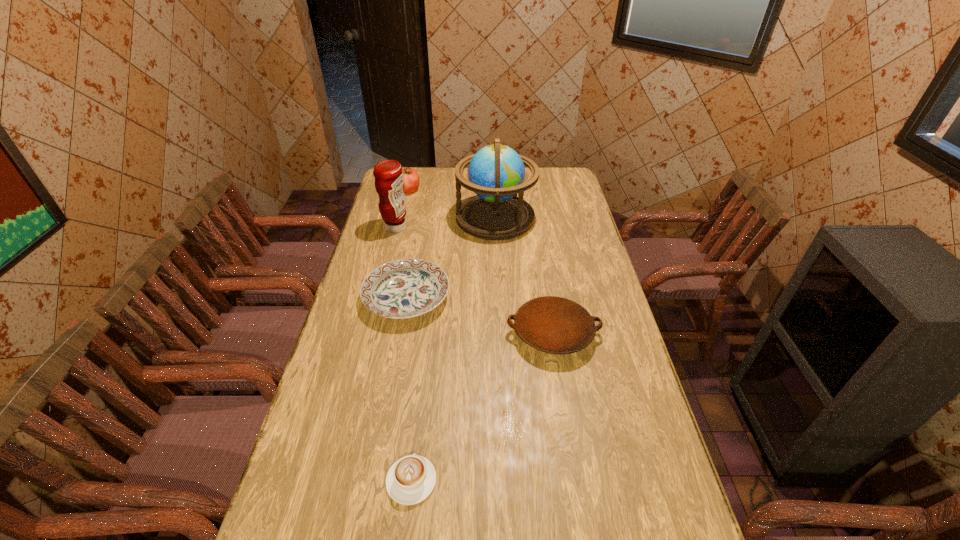
Locate an element on the screen. The width and height of the screenshot is (960, 540). object positioned at the right edge is located at coordinates (555, 325).

Locate an element on the screen. The height and width of the screenshot is (540, 960). object that is positioned at the far left corner is located at coordinates (411, 181).

Find the location of `vacant space at the left edge of the desktop`. vacant space at the left edge of the desktop is located at coordinates (345, 352).

Find the location of a particular element. This screenshot has width=960, height=540. free space at the right edge of the desktop is located at coordinates click(x=629, y=406).

Where is `free space between the globe and the apple`? free space between the globe and the apple is located at coordinates (452, 204).

Locate an element on the screen. Image resolution: width=960 pixels, height=540 pixels. empty space between the condiment and the cappuccino is located at coordinates (403, 354).

The height and width of the screenshot is (540, 960). Find the location of `free space between the globe and the second tallest object`. free space between the globe and the second tallest object is located at coordinates (445, 222).

Where is `free space between the nearest object and the globe`? The image size is (960, 540). free space between the nearest object and the globe is located at coordinates (453, 349).

Find the location of a particular element. This screenshot has height=540, width=960. empty location between the shorter plate and the cappuccino is located at coordinates coord(409,389).

Find the location of `vacant point located between the taller plate and the second tallest object`. vacant point located between the taller plate and the second tallest object is located at coordinates (474, 281).